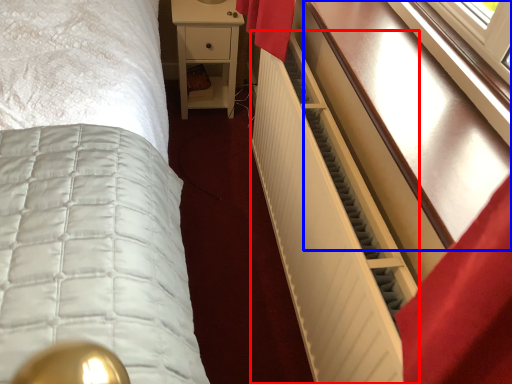
Question: Which object is closer to the camera taking this photo, radiator (highlighted by a red box) or vanity (highlighted by a blue box)?

Choices:
 (A) radiator
 (B) vanity

Answer: (B)